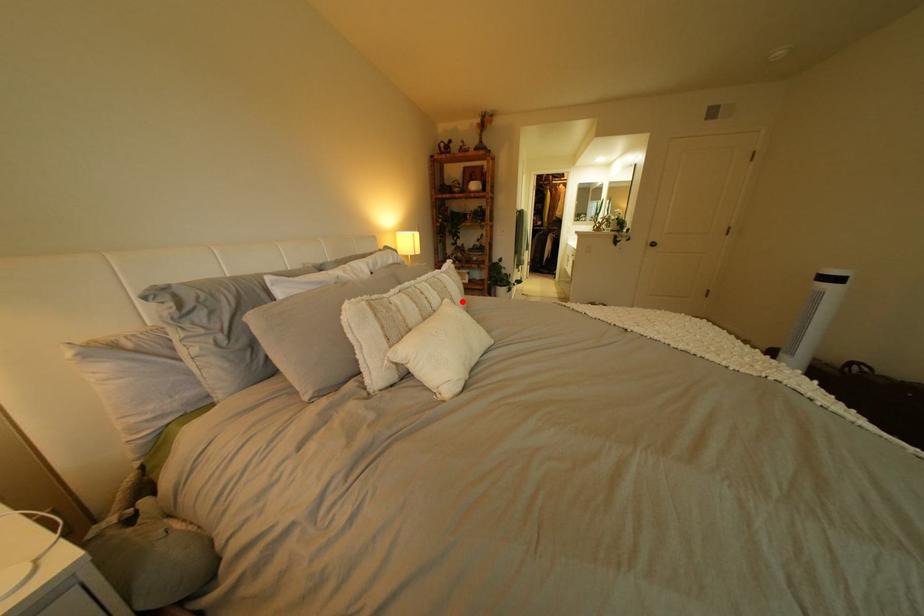
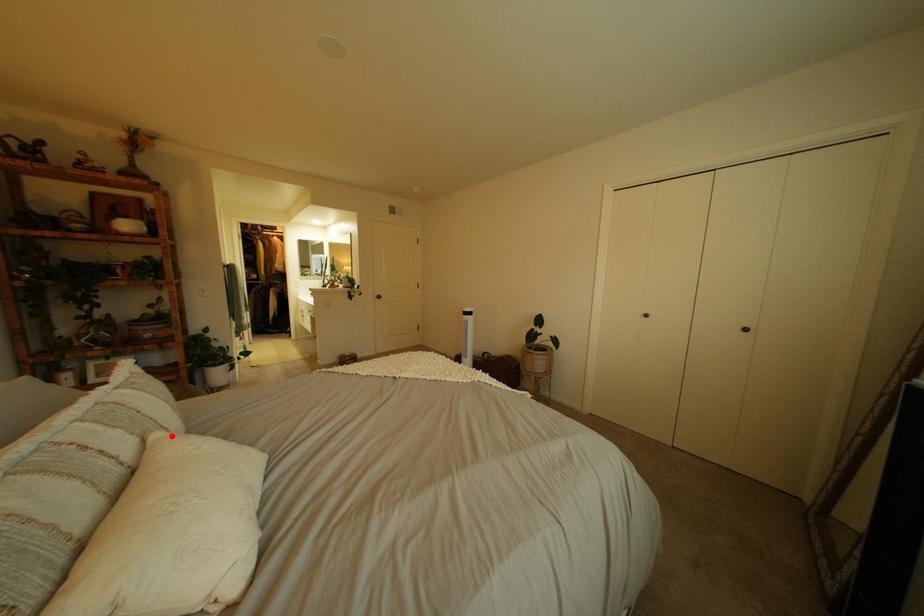
I am providing you with two images of the same scene from different viewpoints. A red point is marked on the first image and another point is marked on the second image. Do the highlighted points in image1 and image2 indicate the same real-world spot?

Yes